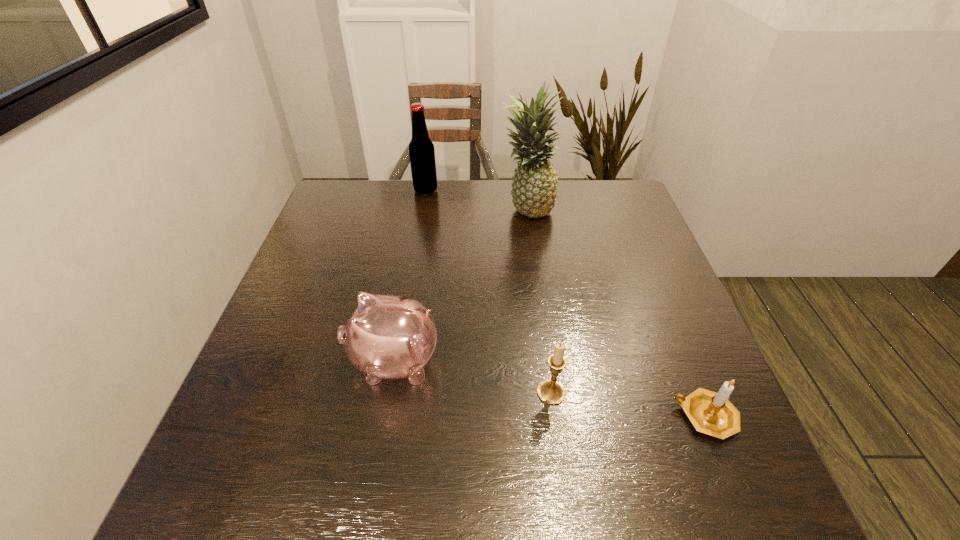
The image size is (960, 540). What are the coordinates of `the tallest object` in the screenshot? It's located at (534, 191).

Locate an element on the screen. This screenshot has height=540, width=960. the fourth shortest object is located at coordinates (421, 149).

Where is `piggy bank`? This screenshot has width=960, height=540. piggy bank is located at coordinates (386, 337).

I want to click on the left candle holder, so click(x=550, y=391).

At what (x,y) coordinates should I click in order to perform the action: click on the shortest object. Please return your answer as a coordinate pair (x, y). This screenshot has width=960, height=540. Looking at the image, I should click on (711, 413).

You are a GUI agent. You are given a task and a screenshot of the screen. Output one action in this format:
    pyautogui.click(x=<x>, y=<y>)
    Task: Click on the shorter candle holder
    Image resolution: width=960 pixels, height=540 pixels.
    Given the screenshot: What is the action you would take?
    pyautogui.click(x=711, y=413)

This screenshot has height=540, width=960. I want to click on vacant point located on the left of the tallest object, so click(430, 211).

This screenshot has width=960, height=540. Identify the location of vacant space situated 0.210m on the right of the beer bottle. (503, 191).

Locate an element on the screen. Image resolution: width=960 pixels, height=540 pixels. vacant space located on the front facing side of the piggy bank is located at coordinates (281, 362).

Identify the location of vacant space located on the front facing side of the piggy bank. (262, 362).